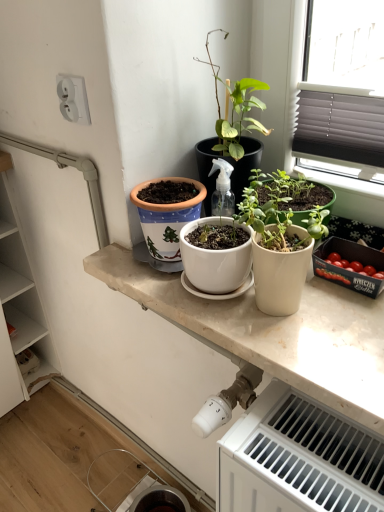
Find the location of `vacant area that lies in front of terracotta clay pot at center`. vacant area that lies in front of terracotta clay pot at center is located at coordinates (185, 305).